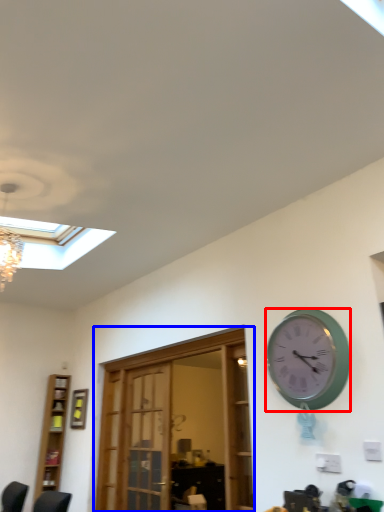
Question: Which point is further to the camera, wall clock (highlighted by a red box) or door (highlighted by a blue box)?

Choices:
 (A) wall clock
 (B) door

Answer: (B)